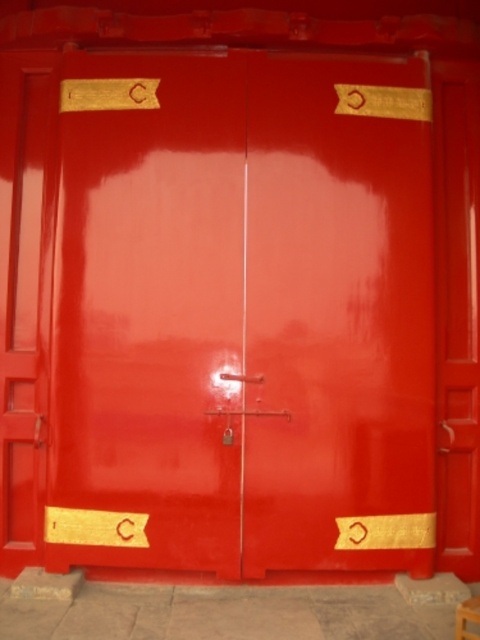
From the picture: You are standing in front of the red double doors and want to reach both points marked on the doors. Which point, point (x=427, y=140) or point (x=466, y=636), is closer to you?

Point (x=466, y=636) is closer to you because it is less further to the camera than point (x=427, y=140).

You are standing in front of the doors shown in the image. There is a point marked at coordinates (242, 314). Which door is this point located on?

The point at coordinates (242, 314) is located on the glossy red door at center.